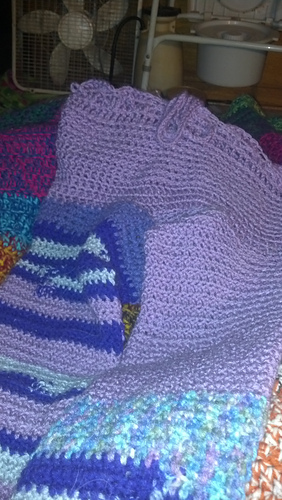
The image size is (282, 500). What are the coordinates of `metal frame` in the screenshot? It's located at (175, 38).